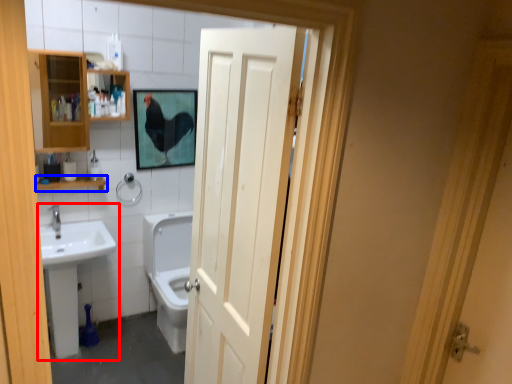
Question: Which object is further to the camera taking this photo, sink (highlighted by a red box) or balustrade (highlighted by a blue box)?

Choices:
 (A) sink
 (B) balustrade

Answer: (B)